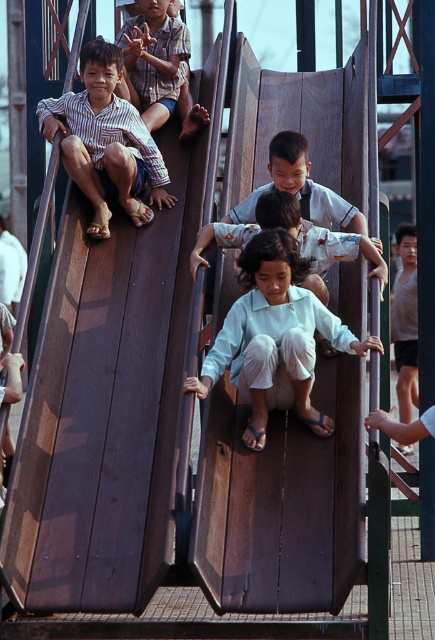
Looking at this image, is matte striped shirt at left to the left of smooth white shirt at center from the viewer's perspective?

Indeed, matte striped shirt at left is positioned on the left side of smooth white shirt at center.

Which is below, matte striped shirt at left or smooth white shirt at center?

smooth white shirt at center

The width and height of the screenshot is (435, 640). Find the location of `matte striped shirt at left`. matte striped shirt at left is located at coordinates (106, 141).

I want to click on matte striped shirt at left, so click(x=106, y=141).

Which is behind, point (187, 74) or point (318, 282)?

Positioned behind is point (187, 74).

Can you confirm if striped cotton shirt at upper left is thinner than light blue shirt at center?

Correct, striped cotton shirt at upper left's width is less than light blue shirt at center's.

Describe the element at coordinates (159, 67) in the screenshot. I see `striped cotton shirt at upper left` at that location.

Find the location of a particular element. This screenshot has width=435, height=640. striped cotton shirt at upper left is located at coordinates [x=159, y=67].

What are the coordinates of `matte striped shirt at left` in the screenshot? It's located at (106, 141).

Is matte striped shirt at left shorter than light blue fabric pants at center?

Incorrect, matte striped shirt at left's height does not fall short of light blue fabric pants at center's.

This screenshot has height=640, width=435. I want to click on matte striped shirt at left, so click(106, 141).

The height and width of the screenshot is (640, 435). I want to click on matte striped shirt at left, so click(x=106, y=141).